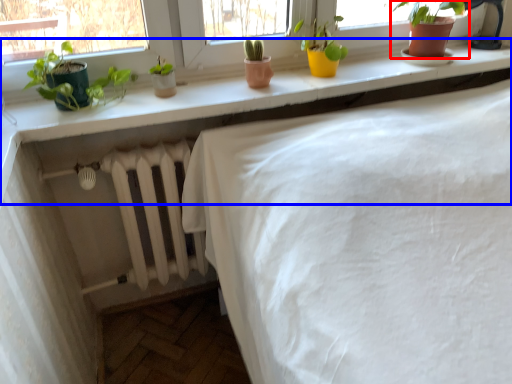
Question: Which object is closer to the camera taking this photo, houseplant (highlighted by a red box) or counter (highlighted by a blue box)?

Choices:
 (A) houseplant
 (B) counter

Answer: (B)